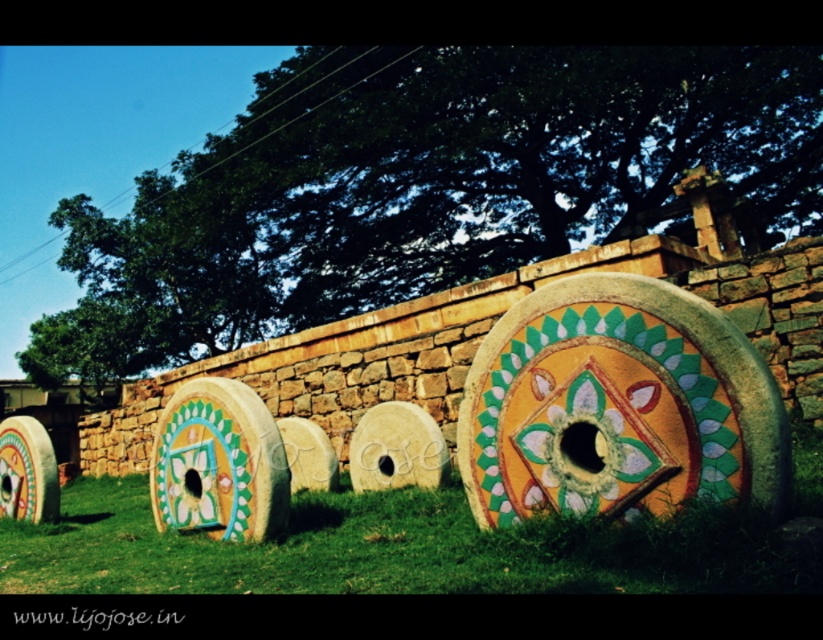
Question: Is green grass at center thinner than matte painted wheel at center?

Choices:
 (A) yes
 (B) no

Answer: (B)

Question: Which of the following is the closest to the observer?

Choices:
 (A) (543, 426)
 (B) (149, 518)

Answer: (A)

Question: Among these objects, which one is farthest from the camera?

Choices:
 (A) matte painted wooden wheel at lower left
 (B) matte painted wheel at center

Answer: (A)

Question: Observing the image, what is the correct spatial positioning of green grass at center in reference to matte painted wheel at center?

Choices:
 (A) left
 (B) right

Answer: (A)

Question: Estimate the real-world distances between objects in this image. Which object is farther from the matte painted wooden wheel at lower left?

Choices:
 (A) matte painted wheel at center
 (B) green grass at center

Answer: (A)

Question: Considering the relative positions of green grass at center and matte painted wheel at center in the image provided, where is green grass at center located with respect to matte painted wheel at center?

Choices:
 (A) left
 (B) right

Answer: (A)